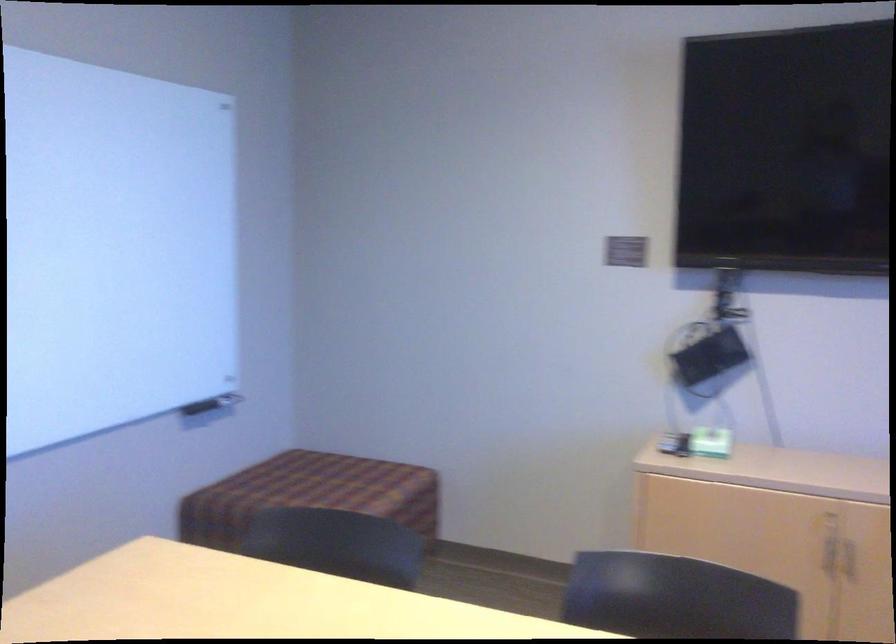
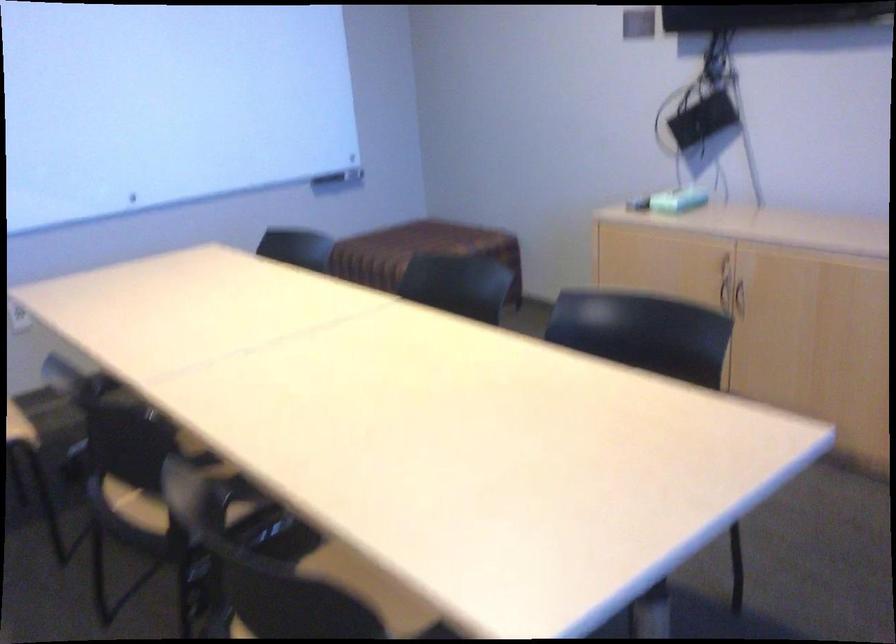
Find the pixel in the second image that matches (806,562) in the first image.

(725, 295)